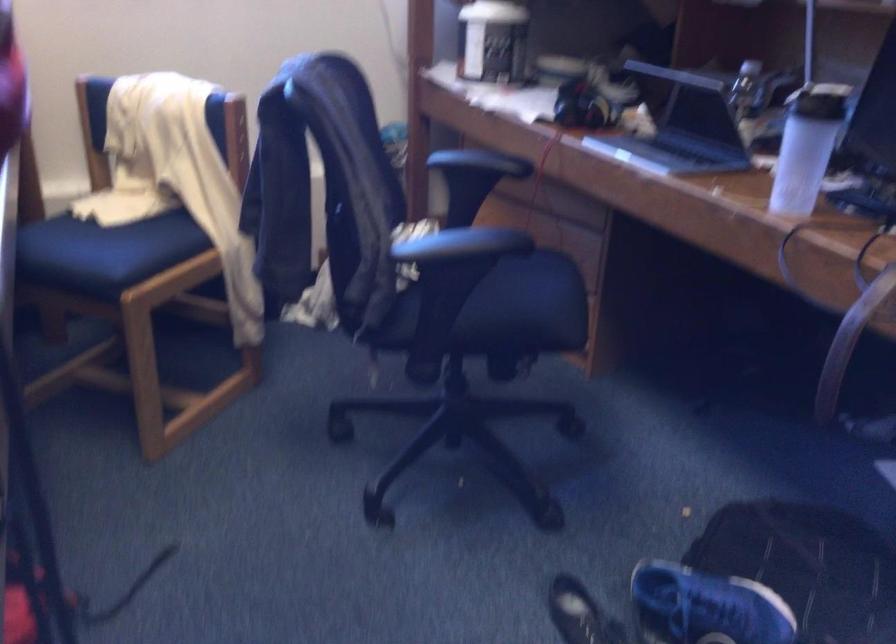
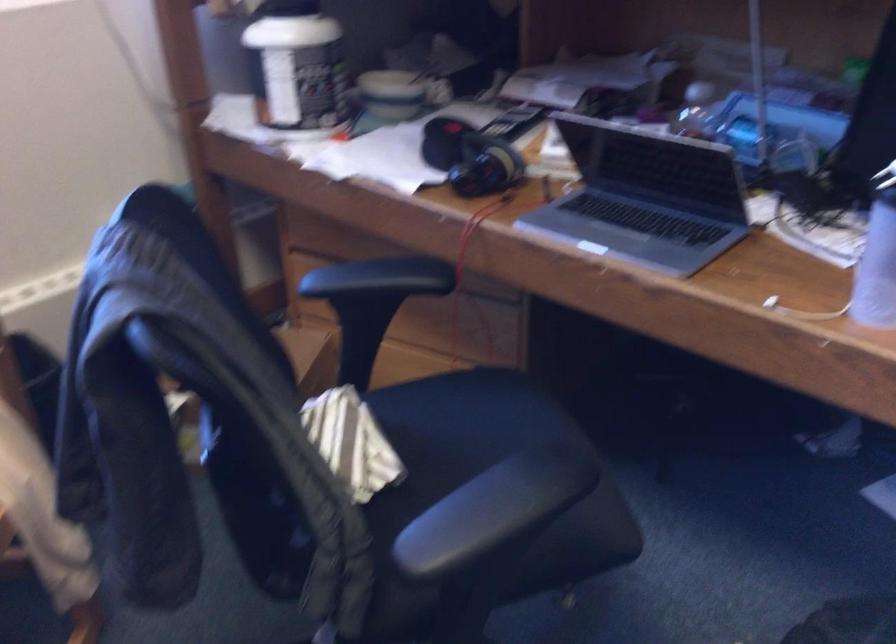
Question: Based on the continuous images, in which direction is the camera rotating? Reply with the corresponding letter.

Choices:
 (A) Left
 (B) Right
 (C) Up
 (D) Down

Answer: (B)